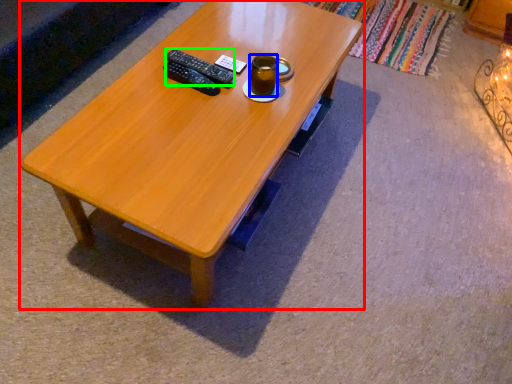
Question: Which is nearer to the coffee table (highlighted by a red box)? beverage (highlighted by a blue box) or remote (highlighted by a green box).

Choices:
 (A) beverage
 (B) remote

Answer: (B)